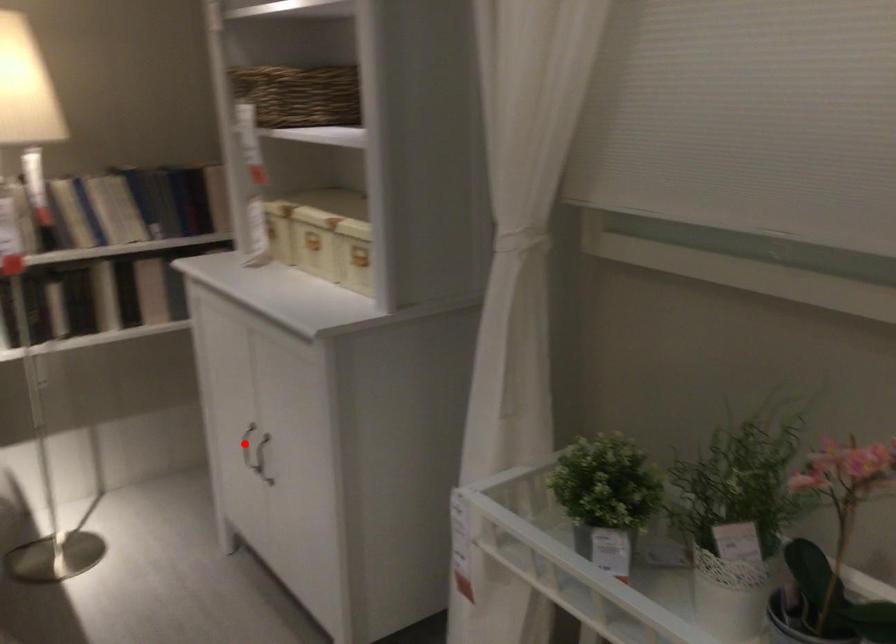
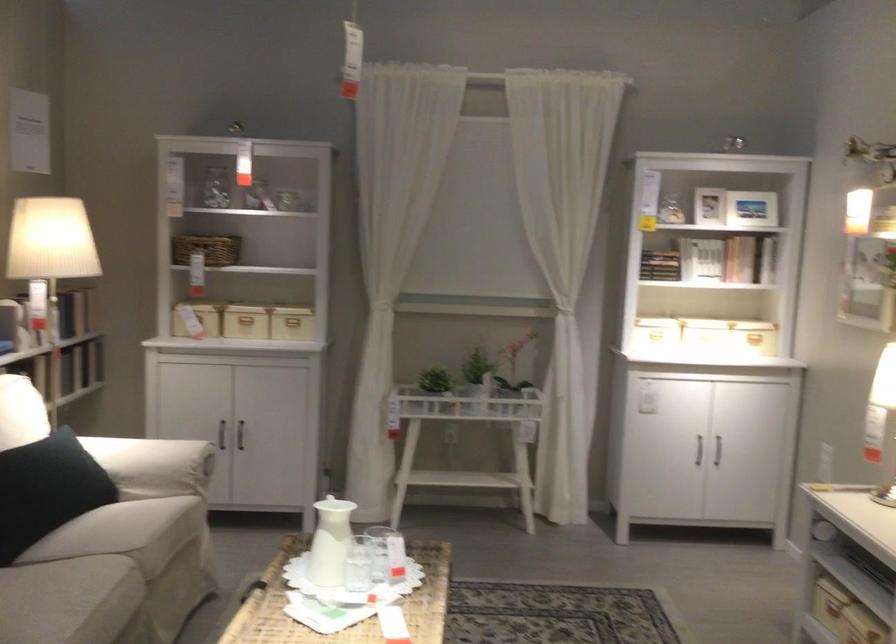
Where in the second image is the point corresponding to the highlighted location from the first image?

(221, 433)